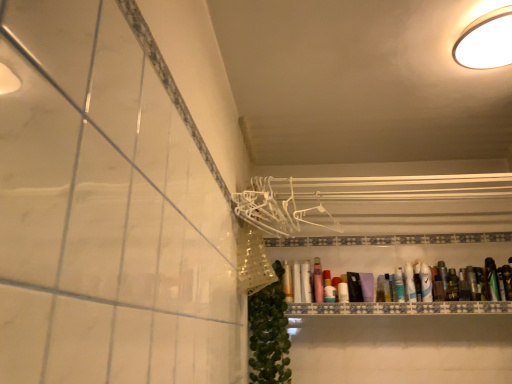
Question: Considering the relative sizes of green matte bottle at right, which is counted as the 10th toiletry, starting from the left, and translucent plastic bottle at upper right, arranged as the seventh toiletry when viewed from the left, in the image provided, is green matte bottle at right, which is counted as the 10th toiletry, starting from the left, smaller than translucent plastic bottle at upper right, arranged as the seventh toiletry when viewed from the left,?

Choices:
 (A) yes
 (B) no

Answer: (A)

Question: From a real-world perspective, is green matte bottle at right, the second toiletry when ordered from right to left, located higher than translucent plastic bottle at upper right, positioned as the fifth toiletry in right-to-left order?

Choices:
 (A) yes
 (B) no

Answer: (A)

Question: Is green matte bottle at right, the second toiletry when ordered from right to left, facing away from translucent plastic bottle at upper right, positioned as the fifth toiletry in right-to-left order?

Choices:
 (A) no
 (B) yes

Answer: (A)

Question: Does green matte bottle at right, the second toiletry when ordered from right to left, have a greater height compared to translucent plastic bottle at upper right, arranged as the seventh toiletry when viewed from the left?

Choices:
 (A) yes
 (B) no

Answer: (A)

Question: Is translucent plastic bottle at upper right, positioned as the fifth toiletry in right-to-left order, a part of green matte bottle at right, which is counted as the 10th toiletry, starting from the left?

Choices:
 (A) no
 (B) yes

Answer: (A)

Question: Does green matte bottle at right, which is counted as the 10th toiletry, starting from the left, have a lesser height compared to translucent plastic bottle at upper right, arranged as the seventh toiletry when viewed from the left?

Choices:
 (A) yes
 (B) no

Answer: (B)

Question: Is white glossy light fixture at upper right taller than matte pink lotion at center, the 8th toiletry in the right-to-left sequence?

Choices:
 (A) yes
 (B) no

Answer: (B)

Question: Is white glossy light fixture at upper right outside matte pink lotion at center, which is the 4th toiletry from left to right?

Choices:
 (A) yes
 (B) no

Answer: (A)

Question: From the image's perspective, is white glossy light fixture at upper right under matte pink lotion at center, the 8th toiletry in the right-to-left sequence?

Choices:
 (A) no
 (B) yes

Answer: (A)

Question: Does white glossy light fixture at upper right have a lesser height compared to matte pink lotion at center, which is the 4th toiletry from left to right?

Choices:
 (A) no
 (B) yes

Answer: (B)

Question: Can you confirm if white glossy light fixture at upper right is thinner than matte pink lotion at center, which is the 4th toiletry from left to right?

Choices:
 (A) yes
 (B) no

Answer: (B)

Question: Can you confirm if white glossy light fixture at upper right is positioned to the right of matte pink lotion at center, which is the 4th toiletry from left to right?

Choices:
 (A) yes
 (B) no

Answer: (A)

Question: Considering the relative sizes of white glossy bottle at upper right, which ranks as the eighth toiletry in left-to-right order, and green matte bottle at right, which is counted as the 10th toiletry, starting from the left, in the image provided, is white glossy bottle at upper right, which ranks as the eighth toiletry in left-to-right order, wider than green matte bottle at right, which is counted as the 10th toiletry, starting from the left,?

Choices:
 (A) no
 (B) yes

Answer: (A)